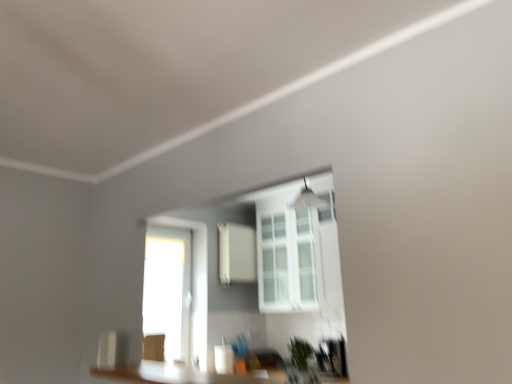
Identify the location of white glass window at center. (288, 252).

The width and height of the screenshot is (512, 384). I want to click on white matte medicine cabinet at center, so click(x=237, y=253).

This screenshot has height=384, width=512. I want to click on white glass window at center, so click(x=288, y=252).

Is white matte medicine cabinet at center outside of white glass window at center?

white matte medicine cabinet at center lies outside white glass window at center's area.

In the scene shown: From the image's perspective, is white matte medicine cabinet at center located above white glass window at center?

No.

Is white matte medicine cabinet at center beside white glass window at center?

white matte medicine cabinet at center and white glass window at center are not in contact.

In the image, is green matte plant at lower center positioned in front of or behind white glass window at center?

Visually, green matte plant at lower center is located in front of white glass window at center.

In the image, there is a green matte plant at lower center. Identify the location of window above it (from the image's perspective). point(288,252).

From the image's perspective, which object appears higher, green matte plant at lower center or white glass window at center?

white glass window at center is shown above in the image.

Considering the positions of points (290, 369) and (291, 211), is point (290, 369) farther from camera compared to point (291, 211)?

No, it is not.

Considering the relative positions of white glass window at center and white matte medicine cabinet at center in the image provided, is white glass window at center to the left or to the right of white matte medicine cabinet at center?

Based on their positions, white glass window at center is located to the right of white matte medicine cabinet at center.

Find the location of a particular element. medicine cabinet positioned vertically above the white glass window at center (from a real-world perspective) is located at coordinates (237, 253).

What's the angular difference between white glass window at center and white matte medicine cabinet at center's facing directions?

90.2 degrees separate the facing orientations of white glass window at center and white matte medicine cabinet at center.

Is white glass window at center facing away from white matte medicine cabinet at center?

white glass window at center is not turned away from white matte medicine cabinet at center.

Which object is further away from the camera taking this photo, green matte plant at lower center or white matte medicine cabinet at center?

Positioned behind is white matte medicine cabinet at center.

Which of these two, green matte plant at lower center or white matte medicine cabinet at center, is wider?

With larger width is white matte medicine cabinet at center.

Which is correct: green matte plant at lower center is inside white matte medicine cabinet at center, or outside of it?

green matte plant at lower center is not inside white matte medicine cabinet at center, it's outside.

Is point (309, 353) positioned behind point (244, 271)?

No, it is in front of (244, 271).

Is white matte medicine cabinet at center to the left or to the right of green matte plant at lower center in the image?

In the image, white matte medicine cabinet at center appears on the left side of green matte plant at lower center.

Is white matte medicine cabinet at center directly adjacent to green matte plant at lower center?

No.

Does point (245, 228) lie behind point (297, 380)?

That is True.

Can you confirm if white matte medicine cabinet at center is bigger than green matte plant at lower center?

Yes, white matte medicine cabinet at center is bigger than green matte plant at lower center.

Is white glass window at center inside the boundaries of green matte plant at lower center, or outside?

white glass window at center is not enclosed by green matte plant at lower center.

Which is further, (x=263, y=208) or (x=300, y=344)?

The point (x=263, y=208) is more distant.

Which object is further away from the camera, white glass window at center or green matte plant at lower center?

white glass window at center is more distant.

Identify the location of window that appears on the right of green matte plant at lower center. (288, 252).

I want to click on medicine cabinet behind the white glass window at center, so click(237, 253).

Find the location of `window that appears above the green matte plant at lower center (from a real-world perspective)`. window that appears above the green matte plant at lower center (from a real-world perspective) is located at coordinates (288, 252).

When comparing their distances from green matte plant at lower center, does white matte medicine cabinet at center or white glass window at center seem closer?

Among the two, white glass window at center is located nearer to green matte plant at lower center.

Estimate the real-world distances between objects in this image. Which object is closer to green matte plant at lower center, white glass window at center or white matte medicine cabinet at center?

white glass window at center is closer to green matte plant at lower center.

Which object lies nearer to the anchor point white matte medicine cabinet at center, white glass window at center or green matte plant at lower center?

white glass window at center is positioned closer to the anchor white matte medicine cabinet at center.

Considering their positions, is green matte plant at lower center positioned closer to white glass window at center than white matte medicine cabinet at center?

white matte medicine cabinet at center lies closer to white glass window at center than the other object.

From the image, which object appears to be nearer to white glass window at center, white matte medicine cabinet at center or green matte plant at lower center?

white matte medicine cabinet at center is closer to white glass window at center.

Which object lies nearer to the anchor point white matte medicine cabinet at center, green matte plant at lower center or white glass window at center?

white glass window at center lies closer to white matte medicine cabinet at center than the other object.

The height and width of the screenshot is (384, 512). What are the coordinates of `window positioned between green matte plant at lower center and white matte medicine cabinet at center from near to far` in the screenshot? It's located at (288, 252).